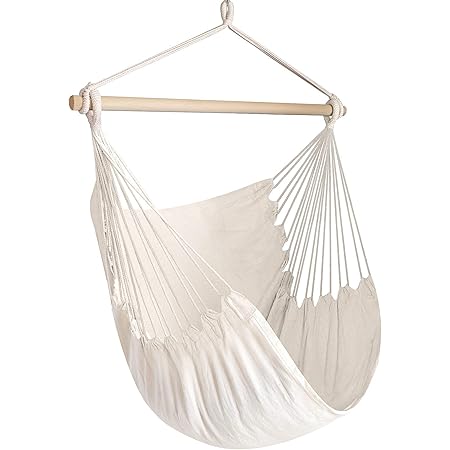
Where is `wooden rod`? The width and height of the screenshot is (450, 450). wooden rod is located at coordinates (230, 103).